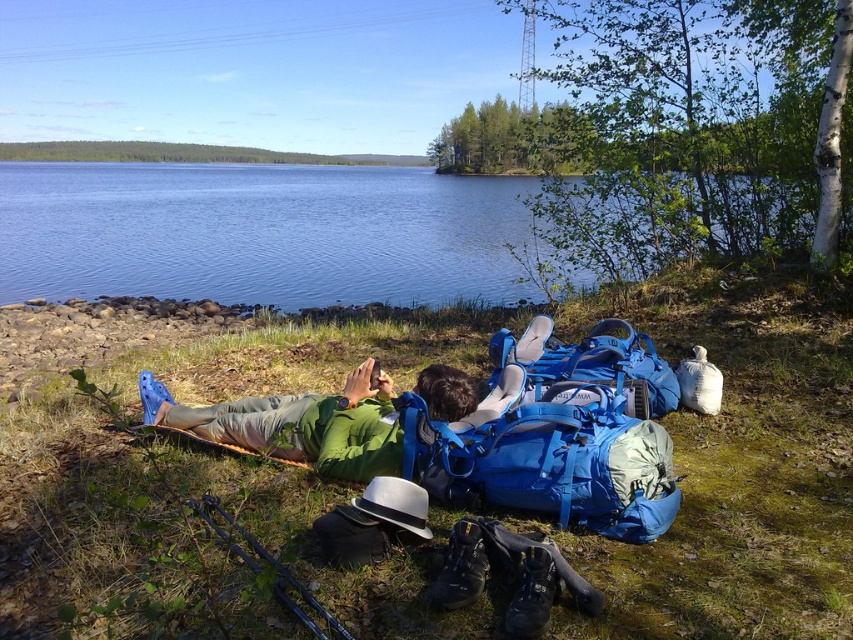
Is point (201, 272) positioned behind point (321, 416)?

Yes, it is.

Between blue water at center and green fabric person at center, which one has more height?

blue water at center is taller.

Describe the element at coordinates (260, 234) in the screenshot. I see `blue water at center` at that location.

Image resolution: width=853 pixels, height=640 pixels. Identify the location of blue water at center. (260, 234).

Who is more distant from viewer, (386, 627) or (79, 285)?

The point (79, 285) is more distant.

Is green grass at lower center closer to the viewer compared to blue water at center?

Yes, it is.

Who is more forward, (799, 397) or (15, 266)?

Point (799, 397) is in front.

This screenshot has height=640, width=853. I want to click on green grass at lower center, so click(740, 467).

Who is higher up, green grass at lower center or green fabric person at center?

green grass at lower center is above.

Who is shorter, green grass at lower center or green fabric person at center?

green fabric person at center

The image size is (853, 640). I want to click on green grass at lower center, so click(740, 467).

Image resolution: width=853 pixels, height=640 pixels. I want to click on green grass at lower center, so click(740, 467).